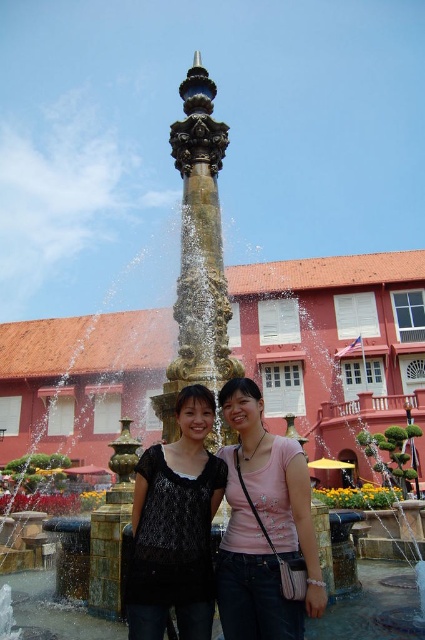
You are standing in the outdoor scene and want to locate the point at coordinates (263, 525). According to the scene description, which object is this point located on?

The point at coordinates (263, 525) is located on the matte black shirt at center.

You are a photographer trying to capture both the matte black shirt at center and the matte black top at center in a single frame. Since you want to ensure both are visible, which object should you focus on first to account for their sizes?

The matte black shirt at center is wider than the matte black top at center, so you should focus on the matte black shirt at center first to ensure its full width is captured in the frame.